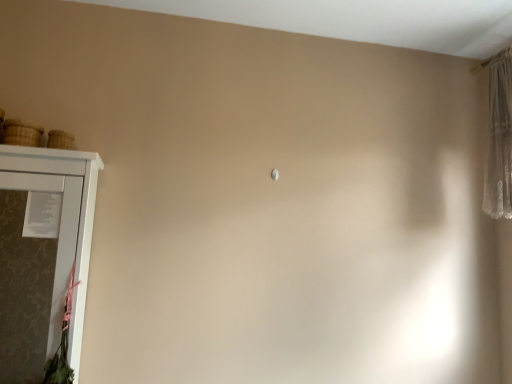
Question: Considering the relative sizes of white matte cupboard at left and brown woven basket at left, arranged as the 1th basket when viewed from the left, in the image provided, is white matte cupboard at left smaller than brown woven basket at left, arranged as the 1th basket when viewed from the left,?

Choices:
 (A) yes
 (B) no

Answer: (B)

Question: Is white matte cupboard at left not within brown woven basket at left, the second basket from the right?

Choices:
 (A) no
 (B) yes

Answer: (B)

Question: Can you confirm if white matte cupboard at left is positioned to the right of brown woven basket at left, arranged as the 1th basket when viewed from the left?

Choices:
 (A) yes
 (B) no

Answer: (A)

Question: Can you confirm if white matte cupboard at left is shorter than brown woven basket at left, arranged as the 1th basket when viewed from the left?

Choices:
 (A) yes
 (B) no

Answer: (B)

Question: From a real-world perspective, is white matte cupboard at left over brown woven basket at left, arranged as the 1th basket when viewed from the left?

Choices:
 (A) no
 (B) yes

Answer: (A)

Question: Can you confirm if white matte cupboard at left is thinner than brown woven basket at left, the second basket from the right?

Choices:
 (A) no
 (B) yes

Answer: (A)

Question: Does woven straw basket at upper left, placed as the second basket when sorted from left to right, have a smaller size compared to white matte cupboard at left?

Choices:
 (A) no
 (B) yes

Answer: (B)

Question: Is woven straw basket at upper left, which appears as the 1th basket when viewed from the right, positioned behind white matte cupboard at left?

Choices:
 (A) yes
 (B) no

Answer: (A)

Question: Does woven straw basket at upper left, which appears as the 1th basket when viewed from the right, have a lesser height compared to white matte cupboard at left?

Choices:
 (A) no
 (B) yes

Answer: (B)

Question: Does woven straw basket at upper left, placed as the second basket when sorted from left to right, have a greater height compared to white matte cupboard at left?

Choices:
 (A) no
 (B) yes

Answer: (A)

Question: Is woven straw basket at upper left, which appears as the 1th basket when viewed from the right, outside white matte cupboard at left?

Choices:
 (A) yes
 (B) no

Answer: (A)

Question: Is woven straw basket at upper left, which appears as the 1th basket when viewed from the right, not near white matte cupboard at left?

Choices:
 (A) no
 (B) yes

Answer: (B)

Question: Is woven straw basket at upper left, placed as the second basket when sorted from left to right, touching brown woven basket at left, the second basket from the right?

Choices:
 (A) yes
 (B) no

Answer: (A)